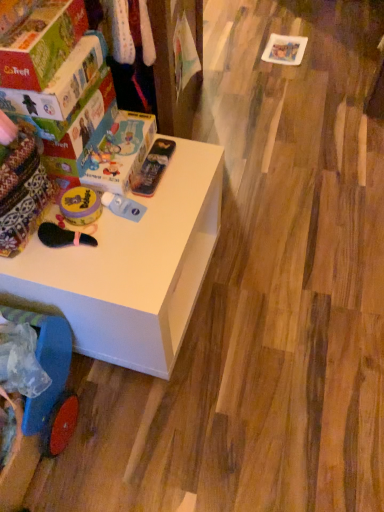
The height and width of the screenshot is (512, 384). I want to click on vacant area that lies to the right of metallic blue pencil case at upper center, the third toy from the left, so point(193,168).